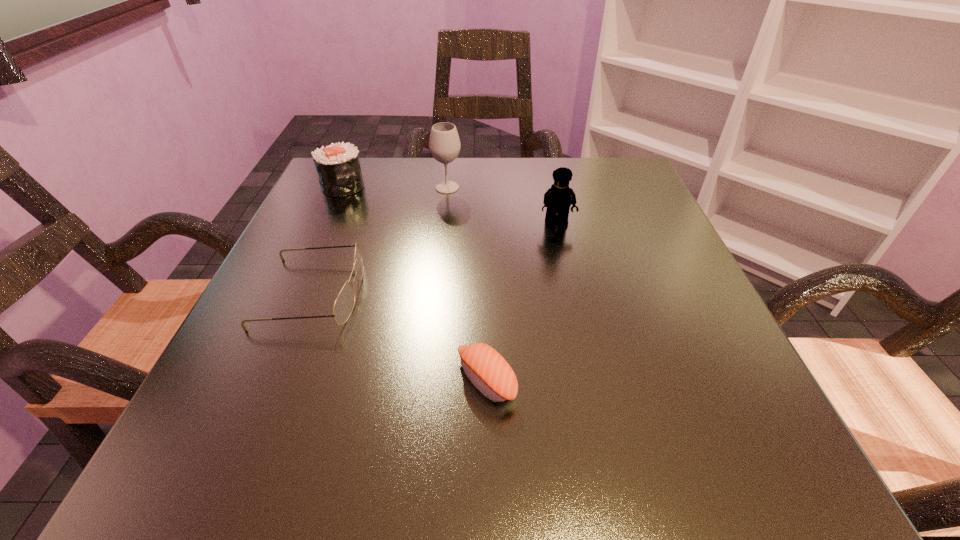
Locate an element on the screen. free space between the left sushi and the nearest object is located at coordinates (415, 284).

Where is `vacant area between the third object from left to right and the farther sushi`? vacant area between the third object from left to right and the farther sushi is located at coordinates (395, 187).

Find the location of a particular element. Image resolution: width=960 pixels, height=540 pixels. free area in between the spectacles and the nearer sushi is located at coordinates (399, 336).

Where is `vacant area that lies between the left sushi and the nearest object`? vacant area that lies between the left sushi and the nearest object is located at coordinates (415, 284).

Identify the location of free space between the third object from right to left and the second nearest object. (379, 240).

Select which object is the second closest to the spectacles. Please provide its 2D coordinates. Your answer should be formatted as a tuple, i.e. [(x, y)], where the tuple contains the x and y coordinates of a point satisfying the conditions above.

[(338, 167)]

Point out which object is positioned as the third nearest to the Lego. Please provide its 2D coordinates. Your answer should be formatted as a tuple, i.e. [(x, y)], where the tuple contains the x and y coordinates of a point satisfying the conditions above.

[(343, 306)]

In order to click on free space that satisfies the following two spatial constraints: 1. on the front-facing side of the third nearest object; 2. on the front-facing side of the spectacles in this screenshot , I will do `click(572, 293)`.

I want to click on vacant area that satisfies the following two spatial constraints: 1. on the front side of the third shortest object; 2. on the left side of the tallest object, so click(342, 187).

Locate an element on the screen. The image size is (960, 540). vacant point that satisfies the following two spatial constraints: 1. on the front-facing side of the fourth shortest object; 2. on the front-facing side of the second nearest object is located at coordinates (572, 293).